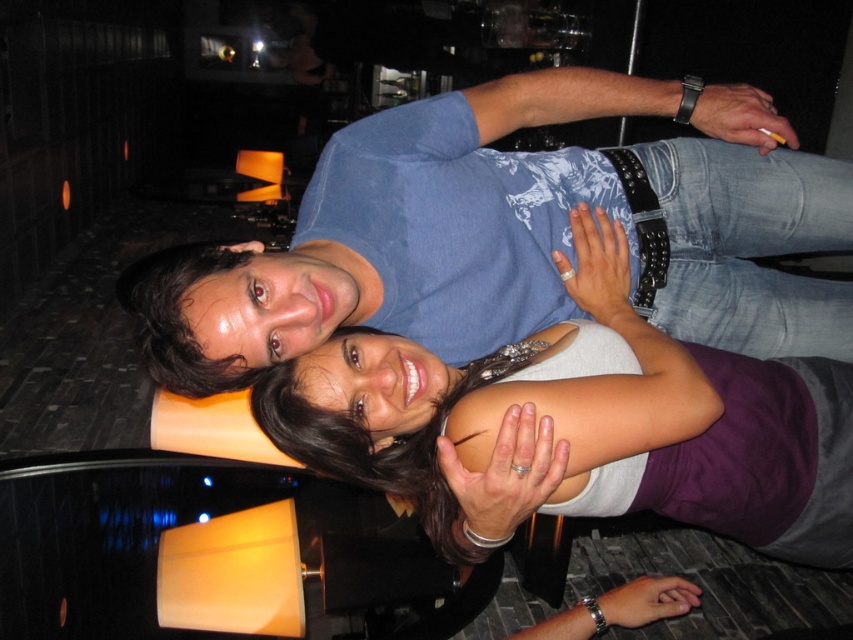
Question: Which point is closer to the camera?

Choices:
 (A) matte white tank top at center
 (B) blue cotton shirt at upper center

Answer: (A)

Question: Which point is farther to the camera?

Choices:
 (A) (799, 532)
 (B) (804, 326)

Answer: (B)

Question: Where is blue cotton shirt at upper center located in relation to matte white tank top at center in the image?

Choices:
 (A) left
 (B) right

Answer: (A)

Question: Is blue cotton shirt at upper center positioned behind matte white tank top at center?

Choices:
 (A) no
 (B) yes

Answer: (B)

Question: Is blue cotton shirt at upper center thinner than matte white tank top at center?

Choices:
 (A) yes
 (B) no

Answer: (B)